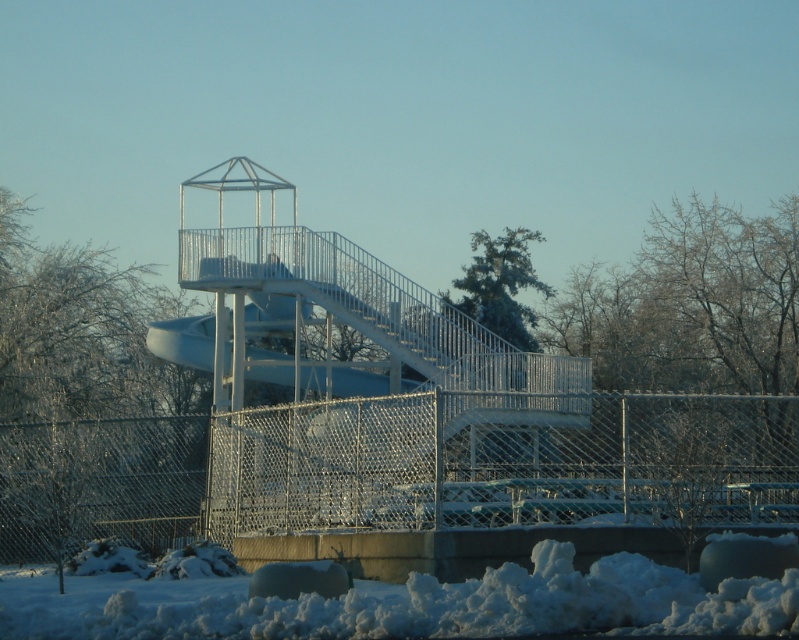
From the picture: You are a snowplow operator tasked with clearing snow from the area. You see the chain link fence at lower center and the white fluffy snow at lower center. Which object will require more time to clear due to its size?

The chain link fence at lower center is larger in size than the white fluffy snow at lower center, so it will require more time to clear.

You are planning to take a photo of the frosty white tree at upper left and the white fluffy snow at lower center. Which object should you focus on first if you want to capture both in a single frame without moving the camera?

You should focus on the frosty white tree at upper left first because it is larger in size than the white fluffy snow at lower center, so it will require more attention to detail to ensure it fits properly in the frame.